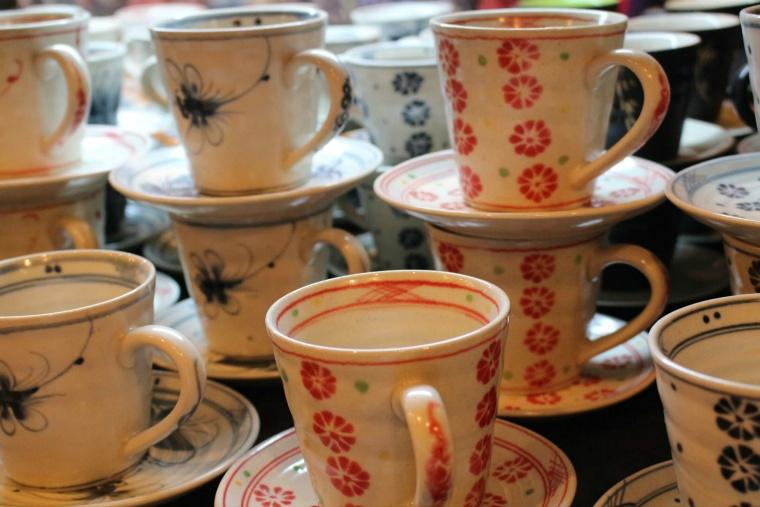
What are the coordinates of `vintage saucers` in the screenshot? It's located at (575, 404), (644, 485), (716, 208), (600, 208), (271, 201), (228, 368), (204, 436), (166, 285), (46, 184).